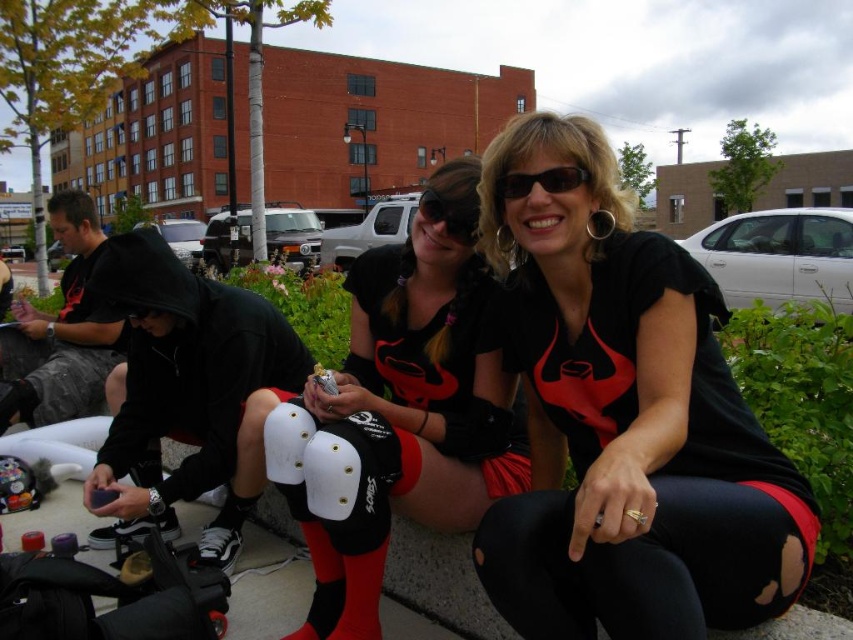
Is matte black knee pads at center positioned in front of white matte knee pad at center?

No, matte black knee pads at center is further to the viewer.

Is point (363, 316) positioned after point (299, 509)?

Yes.

Identify the location of matte black knee pads at center. (405, 404).

Which is below, black matte leggings at center or white matte knee pad at center?

white matte knee pad at center

Can you confirm if black matte leggings at center is positioned below white matte knee pad at center?

No, black matte leggings at center is not below white matte knee pad at center.

Where is `black matte leggings at center`? black matte leggings at center is located at coordinates (625, 420).

Is the position of white matte knee pad at center more distant than that of black plastic sunglasses at upper center?

Yes, it is behind black plastic sunglasses at upper center.

Measure the distance between point (366, 493) and camera.

Point (366, 493) is 1.92 meters from camera.

Image resolution: width=853 pixels, height=640 pixels. In order to click on white matte knee pad at center in this screenshot , I will do `click(335, 472)`.